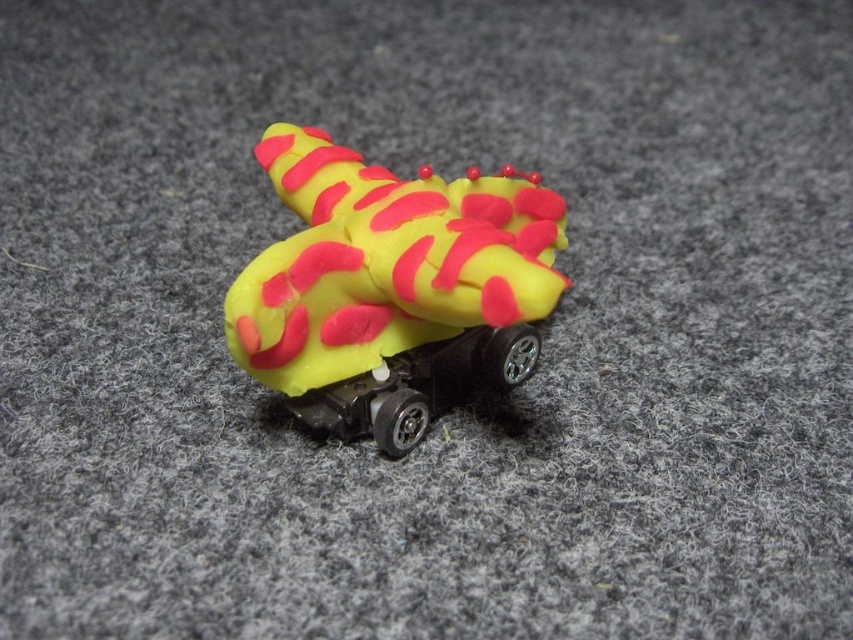
Looking at this image, can you confirm if yellow matte toy at center is taller than yellow matte toy car at center?

Yes.

Locate an element on the screen. yellow matte toy at center is located at coordinates (390, 285).